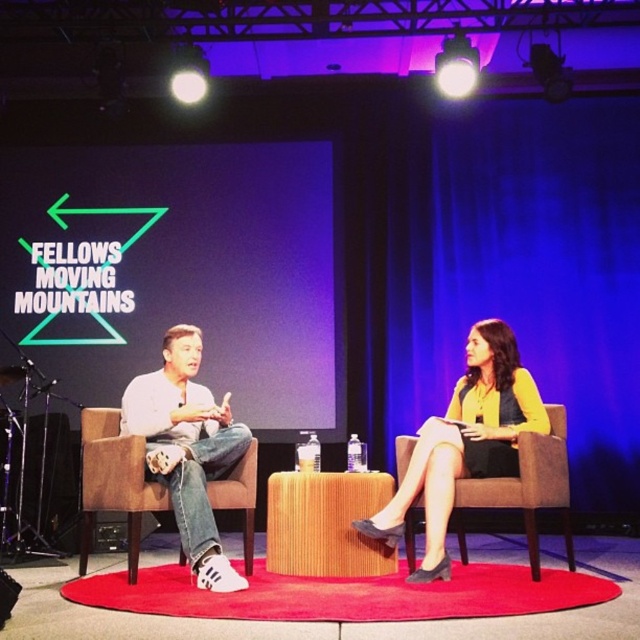
Question: From the image, what is the correct spatial relationship of brown fabric chair at center in relation to matte black speaker at left?

Choices:
 (A) below
 (B) above

Answer: (B)

Question: Does wooden stool at center have a greater width compared to matte black speaker at left?

Choices:
 (A) yes
 (B) no

Answer: (A)

Question: Which object is the closest to the wooden stool at center?

Choices:
 (A) matte black speaker at left
 (B) brown fabric chair at center

Answer: (B)

Question: Which point is farther to the camera?

Choices:
 (A) wooden stool at center
 (B) yellow fabric dress at center

Answer: (A)

Question: Which of these objects is positioned farthest from the matte black speaker at left?

Choices:
 (A) brown fabric chair at center
 (B) yellow fabric dress at center

Answer: (A)

Question: Is yellow fabric dress at center above brown leather chair at center?

Choices:
 (A) yes
 (B) no

Answer: (A)